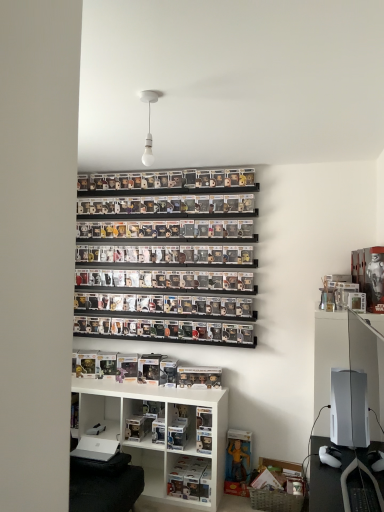
What do you see at coordinates (148, 126) in the screenshot? The width and height of the screenshot is (384, 512). I see `white matte bulb at upper center` at bounding box center [148, 126].

Find the location of `clear plastic figures at center, which is the 1th shelf from top to bottom`. clear plastic figures at center, which is the 1th shelf from top to bottom is located at coordinates (166, 330).

Where is `clear plastic figure at lower center, which is counted as the third shelf, starting from the top`? clear plastic figure at lower center, which is counted as the third shelf, starting from the top is located at coordinates (190, 479).

At what (x,y) coordinates should I click in order to perform the action: click on white plastic shelf at lower center, which is the second shelf from top to bottom. Please return your answer as a coordinate pair (x, y). Looking at the image, I should click on (161, 432).

From a real-world perspective, is white matte bulb at upper center positioned under white plastic shelf at lower center, which is the second shelf from top to bottom, based on gravity?

Actually, white matte bulb at upper center is physically above white plastic shelf at lower center, which is the second shelf from top to bottom, in the real world.

In the scene shown: Is white matte bulb at upper center positioned with its back to white plastic shelf at lower center, which is the second shelf from top to bottom?

white matte bulb at upper center does not have its back to white plastic shelf at lower center, which is the second shelf from top to bottom.

Which point is more distant from viewer, (153, 99) or (165, 425)?

Point (165, 425)

From the image's perspective, is white matte bulb at upper center over white plastic shelf at lower center, acting as the 2th shelf starting from the bottom?

Yes, from the image's perspective, white matte bulb at upper center is over white plastic shelf at lower center, acting as the 2th shelf starting from the bottom.

From the image's perspective, is clear plastic figures at center, placed as the 3th shelf when sorted from bottom to top, located above or below white matte gaming console at right?

Based on their image positions, clear plastic figures at center, placed as the 3th shelf when sorted from bottom to top, is located above white matte gaming console at right.

Is white matte gaming console at right completely or partially inside clear plastic figures at center, placed as the 3th shelf when sorted from bottom to top?

Actually, white matte gaming console at right is outside clear plastic figures at center, placed as the 3th shelf when sorted from bottom to top.

You are a GUI agent. You are given a task and a screenshot of the screen. Output one action in this format:
    pyautogui.click(x=<x>, y=<y>)
    Task: Click on the entertainment center below the clear plastic figures at center, placed as the 3th shelf when sorted from bottom to top (from a real-world perspective)
    
    Given the screenshot: What is the action you would take?
    pyautogui.click(x=349, y=354)

From a real-world perspective, is clear plastic figures at center, placed as the 3th shelf when sorted from bottom to top, above or below white matte gaming console at right?

In terms of real-world spatial position, clear plastic figures at center, placed as the 3th shelf when sorted from bottom to top, is above white matte gaming console at right.

Does white matte bulb at upper center lie behind white matte gaming console at right?

No, white matte bulb at upper center is in front of white matte gaming console at right.

Does white matte bulb at upper center have a larger size compared to white matte gaming console at right?

No.

Which object is positioned more to the left, white matte bulb at upper center or white matte gaming console at right?

From the viewer's perspective, white matte bulb at upper center appears more on the left side.

Based on the photo, can you tell me how much white matte bulb at upper center and white matte gaming console at right differ in facing direction?

The angle between the facing direction of white matte bulb at upper center and the facing direction of white matte gaming console at right is 92.7 degrees.

Based on the photo, is the surface of clear plastic figure at lower center, the first shelf ordered from the bottom, in direct contact with white matte gaming console at right?

No.

Find the location of a particular element. entertainment center that appears in front of the clear plastic figure at lower center, which is counted as the third shelf, starting from the top is located at coordinates (349, 354).

Considering the sizes of objects clear plastic figure at lower center, which is counted as the third shelf, starting from the top, and white matte gaming console at right in the image provided, who is shorter, clear plastic figure at lower center, which is counted as the third shelf, starting from the top, or white matte gaming console at right?

clear plastic figure at lower center, which is counted as the third shelf, starting from the top.

Considering the sizes of clear plastic figure at lower center, which is counted as the third shelf, starting from the top, and white matte gaming console at right in the image, is clear plastic figure at lower center, which is counted as the third shelf, starting from the top, bigger or smaller than white matte gaming console at right?

clear plastic figure at lower center, which is counted as the third shelf, starting from the top, is smaller than white matte gaming console at right.

How distant is clear plastic figures at center, placed as the 3th shelf when sorted from bottom to top, from white plastic shelf at lower center, acting as the 2th shelf starting from the bottom?

clear plastic figures at center, placed as the 3th shelf when sorted from bottom to top, is 25.55 inches away from white plastic shelf at lower center, acting as the 2th shelf starting from the bottom.

From the image's perspective, relative to white plastic shelf at lower center, acting as the 2th shelf starting from the bottom, is clear plastic figures at center, which is the 1th shelf from top to bottom, above or below?

From the image's perspective, clear plastic figures at center, which is the 1th shelf from top to bottom, appears above white plastic shelf at lower center, acting as the 2th shelf starting from the bottom.

Considering the positions of objects clear plastic figures at center, placed as the 3th shelf when sorted from bottom to top, and white plastic shelf at lower center, acting as the 2th shelf starting from the bottom, in the image provided, who is behind, clear plastic figures at center, placed as the 3th shelf when sorted from bottom to top, or white plastic shelf at lower center, acting as the 2th shelf starting from the bottom,?

clear plastic figures at center, placed as the 3th shelf when sorted from bottom to top, is behind.

In the scene shown: Who is shorter, clear plastic figures at center, placed as the 3th shelf when sorted from bottom to top, or white plastic shelf at lower center, which is the second shelf from top to bottom?

clear plastic figures at center, placed as the 3th shelf when sorted from bottom to top.

Is clear plastic figures at center, placed as the 3th shelf when sorted from bottom to top, aimed at clear plastic figure at lower center, which is counted as the third shelf, starting from the top?

No, clear plastic figures at center, placed as the 3th shelf when sorted from bottom to top, is not facing towards clear plastic figure at lower center, which is counted as the third shelf, starting from the top.

Looking at this image, based on their sizes in the image, would you say clear plastic figures at center, placed as the 3th shelf when sorted from bottom to top, is bigger or smaller than clear plastic figure at lower center, which is counted as the third shelf, starting from the top?

clear plastic figures at center, placed as the 3th shelf when sorted from bottom to top, is smaller than clear plastic figure at lower center, which is counted as the third shelf, starting from the top.

In the image, is clear plastic figures at center, placed as the 3th shelf when sorted from bottom to top, positioned in front of or behind clear plastic figure at lower center, the first shelf ordered from the bottom?

clear plastic figures at center, placed as the 3th shelf when sorted from bottom to top, is behind clear plastic figure at lower center, the first shelf ordered from the bottom.

Considering the relative sizes of clear plastic figures at center, which is the 1th shelf from top to bottom, and clear plastic figure at lower center, which is counted as the third shelf, starting from the top, in the image provided, is clear plastic figures at center, which is the 1th shelf from top to bottom, shorter than clear plastic figure at lower center, which is counted as the third shelf, starting from the top,?

Yes, clear plastic figures at center, which is the 1th shelf from top to bottom, is shorter than clear plastic figure at lower center, which is counted as the third shelf, starting from the top.

From the image's perspective, is white matte gaming console at right located above or below white matte bulb at upper center?

From the image's perspective, white matte gaming console at right appears below white matte bulb at upper center.

Find the location of a particular element. Image resolution: width=384 pixels, height=512 pixels. light fixture lying in front of the white matte gaming console at right is located at coordinates (148, 126).

Considering the relative positions of white matte gaming console at right and white matte bulb at upper center in the image provided, is white matte gaming console at right to the right of white matte bulb at upper center from the viewer's perspective?

Correct, you'll find white matte gaming console at right to the right of white matte bulb at upper center.

From a real-world perspective, is white matte gaming console at right below white matte bulb at upper center?

Yes.

I want to click on the 2nd shelf located beneath the white matte bulb at upper center (from a real-world perspective), so click(161, 432).

Where is `entertainment center on the right of clear plastic figures at center, placed as the 3th shelf when sorted from bottom to top`? This screenshot has height=512, width=384. entertainment center on the right of clear plastic figures at center, placed as the 3th shelf when sorted from bottom to top is located at coordinates (349, 354).

Estimate the real-world distances between objects in this image. Which object is closer to clear plastic figures at center, placed as the 3th shelf when sorted from bottom to top, white matte bulb at upper center or white matte gaming console at right?

white matte gaming console at right is positioned closer to the anchor clear plastic figures at center, placed as the 3th shelf when sorted from bottom to top.

Estimate the real-world distances between objects in this image. Which object is closer to white matte gaming console at right, clear plastic figure at lower center, the first shelf ordered from the bottom, or clear plastic figures at center, placed as the 3th shelf when sorted from bottom to top?

Among the two, clear plastic figures at center, placed as the 3th shelf when sorted from bottom to top, is located nearer to white matte gaming console at right.

Based on the photo, when comparing their distances from white matte gaming console at right, does white matte bulb at upper center or clear plastic figures at center, which is the 1th shelf from top to bottom, seem closer?

Among the two, clear plastic figures at center, which is the 1th shelf from top to bottom, is located nearer to white matte gaming console at right.

Considering their positions, is clear plastic figures at center, which is the 1th shelf from top to bottom, positioned closer to white plastic shelf at lower center, acting as the 2th shelf starting from the bottom, than clear plastic figure at lower center, the first shelf ordered from the bottom?

clear plastic figure at lower center, the first shelf ordered from the bottom.

Estimate the real-world distances between objects in this image. Which object is closer to white matte gaming console at right, clear plastic figures at center, placed as the 3th shelf when sorted from bottom to top, or white plastic shelf at lower center, which is the second shelf from top to bottom?

clear plastic figures at center, placed as the 3th shelf when sorted from bottom to top.

Which object lies nearer to the anchor point white plastic shelf at lower center, which is the second shelf from top to bottom, clear plastic figure at lower center, the first shelf ordered from the bottom, or white matte gaming console at right?

Among the two, clear plastic figure at lower center, the first shelf ordered from the bottom, is located nearer to white plastic shelf at lower center, which is the second shelf from top to bottom.

Considering their positions, is white plastic shelf at lower center, which is the second shelf from top to bottom, positioned further to clear plastic figure at lower center, the first shelf ordered from the bottom, than clear plastic figures at center, which is the 1th shelf from top to bottom?

Based on the image, clear plastic figures at center, which is the 1th shelf from top to bottom, appears to be further to clear plastic figure at lower center, the first shelf ordered from the bottom.

When comparing their distances from white matte bulb at upper center, does white matte gaming console at right or white plastic shelf at lower center, which is the second shelf from top to bottom, seem closer?

white matte gaming console at right.

Identify the location of shelf that lies between white matte bulb at upper center and white matte gaming console at right from top to bottom. The image size is (384, 512). (166, 330).

This screenshot has width=384, height=512. In order to click on shelf between clear plastic figures at center, which is the 1th shelf from top to bottom, and white matte gaming console at right, in the horizontal direction in this screenshot , I will do `click(190, 479)`.

Where is `shelf between white matte bulb at upper center and white plastic shelf at lower center, which is the second shelf from top to bottom, from top to bottom`? This screenshot has height=512, width=384. shelf between white matte bulb at upper center and white plastic shelf at lower center, which is the second shelf from top to bottom, from top to bottom is located at coordinates (166, 330).

The image size is (384, 512). What are the coordinates of `entertainment center between white matte bulb at upper center and white plastic shelf at lower center, which is the second shelf from top to bottom, vertically` in the screenshot? It's located at (349, 354).